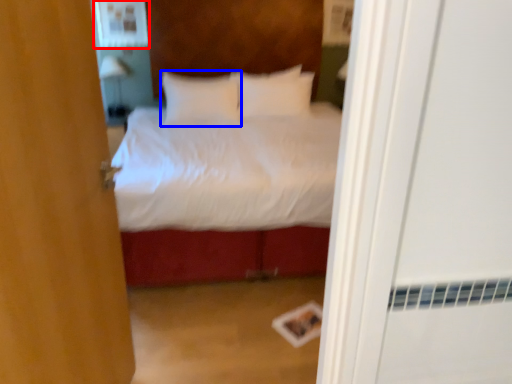
Question: Among these objects, which one is farthest to the camera, medicine cabinet (highlighted by a red box) or pillow (highlighted by a blue box)?

Choices:
 (A) medicine cabinet
 (B) pillow

Answer: (A)